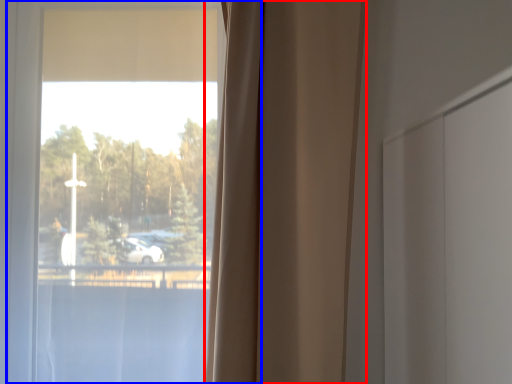
Question: Which of the following is the closest to the observer, curtain (highlighted by a red box) or window (highlighted by a blue box)?

Choices:
 (A) curtain
 (B) window

Answer: (A)